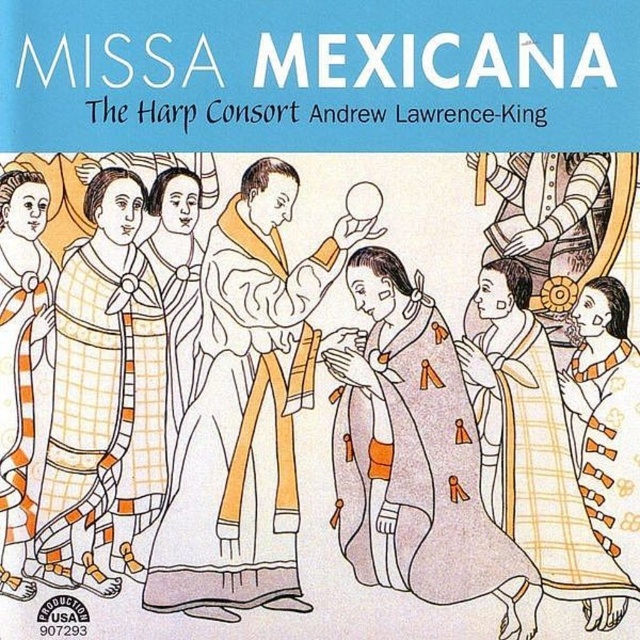
Question: Does white clothed figure at center come behind orange plaid robe at center?

Choices:
 (A) yes
 (B) no

Answer: (A)

Question: Which of the following is the farthest from the observer?

Choices:
 (A) (237, 372)
 (B) (406, 282)

Answer: (A)

Question: Among these objects, which one is farthest from the camera?

Choices:
 (A) orange plaid robe at center
 (B) orange plaid dress at left
 (C) orange striped robe at left
 (D) yellow plaid blanket at lower right

Answer: (C)

Question: Where is orange plaid dress at left located in relation to yellow plaid blanket at lower right in the image?

Choices:
 (A) above
 (B) below

Answer: (A)

Question: Which point is farther to the camera?

Choices:
 (A) (577, 528)
 (B) (12, 499)
 (C) (113, 397)

Answer: (C)

Question: Is white clothed figure at center to the left of orange striped robe at left from the viewer's perspective?

Choices:
 (A) no
 (B) yes

Answer: (A)